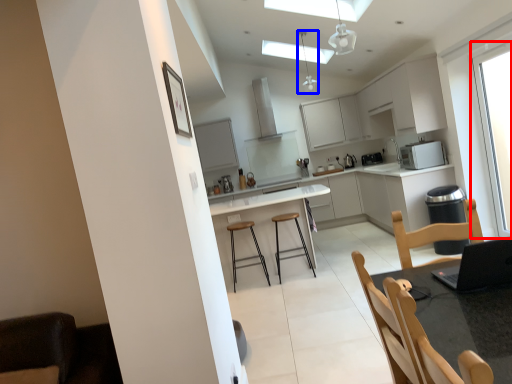
Question: Among these objects, which one is nearest to the camera, window (highlighted by a red box) or light fixture (highlighted by a blue box)?

Choices:
 (A) window
 (B) light fixture

Answer: (A)